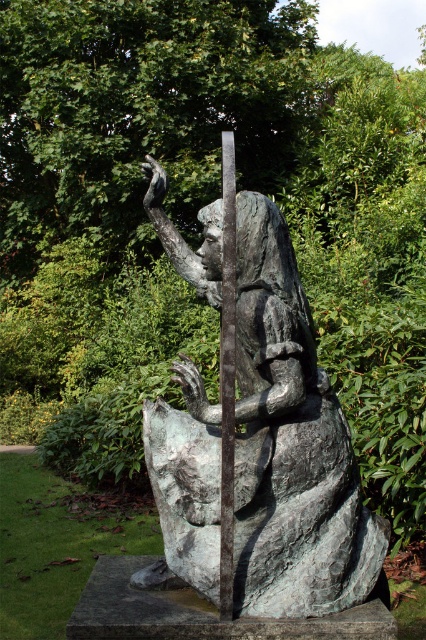
Is bronze statue at center smaller than smooth gray pole at center?

Actually, bronze statue at center might be larger than smooth gray pole at center.

Can you confirm if bronze statue at center is thinner than smooth gray pole at center?

In fact, bronze statue at center might be wider than smooth gray pole at center.

Identify the location of bronze statue at center. This screenshot has width=426, height=640. (290, 445).